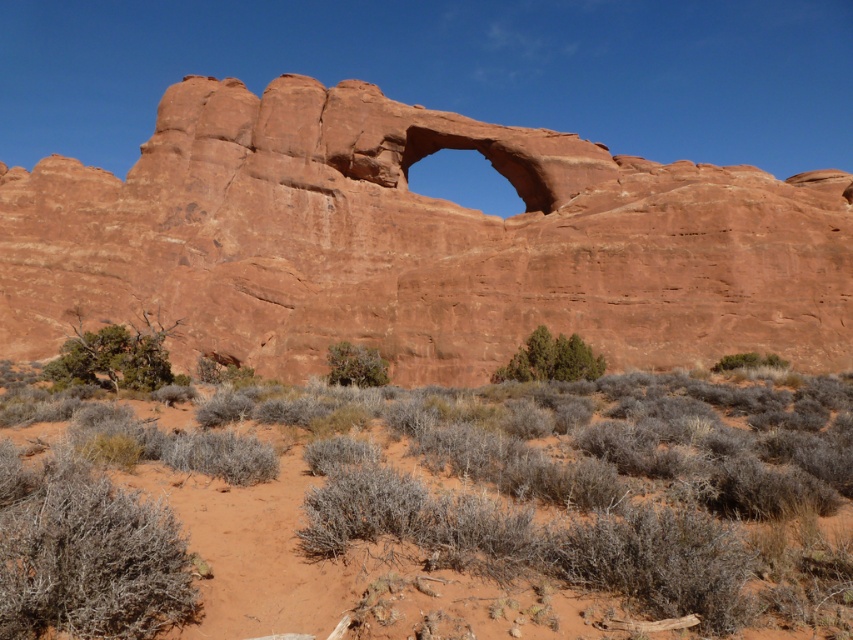
Can you confirm if green leafy shrub at lower left is positioned above green leafy shrub at center?

Yes, green leafy shrub at lower left is above green leafy shrub at center.

Which is below, green leafy shrub at lower left or green leafy shrub at center?

Positioned lower is green leafy shrub at center.

The image size is (853, 640). What do you see at coordinates (112, 358) in the screenshot? I see `green leafy shrub at lower left` at bounding box center [112, 358].

Locate an element on the screen. Image resolution: width=853 pixels, height=640 pixels. green leafy shrub at lower left is located at coordinates (112, 358).

Is rustic sandstone arch at center closer to camera compared to green shrub at center?

No, it is not.

Can you confirm if rustic sandstone arch at center is positioned to the right of green shrub at center?

In fact, rustic sandstone arch at center is to the left of green shrub at center.

Measure the distance between rustic sandstone arch at center and camera.

rustic sandstone arch at center and camera are 52.83 meters apart.

Locate an element on the screen. The width and height of the screenshot is (853, 640). rustic sandstone arch at center is located at coordinates (416, 243).

Who is more forward, (x=332, y=368) or (x=740, y=365)?

Point (x=740, y=365) is more forward.

Where is `green shrub at center`? green shrub at center is located at coordinates (355, 365).

Find the location of a particular element. green shrub at center is located at coordinates (355, 365).